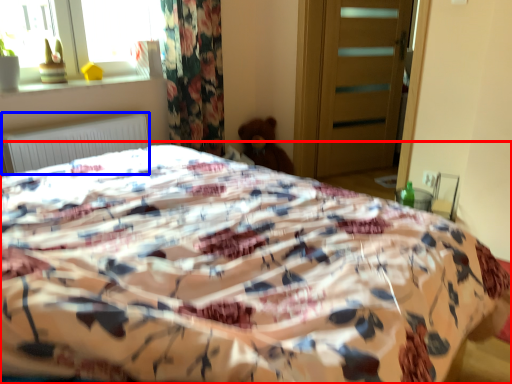
Question: Which object is further to the camera taking this photo, bed (highlighted by a red box) or radiator (highlighted by a blue box)?

Choices:
 (A) bed
 (B) radiator

Answer: (B)